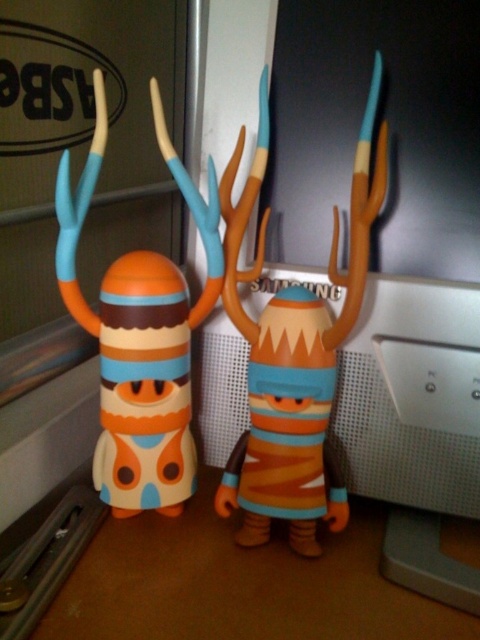
Is matte plastic toy at center taller than matte plastic toy at left?

No.

Is matte plastic toy at center smaller than matte plastic toy at left?

Yes.

Is point (259, 403) positioned before point (191, 179)?

No, it is not.

What are the coordinates of `matte plastic toy at center` in the screenshot? It's located at (294, 353).